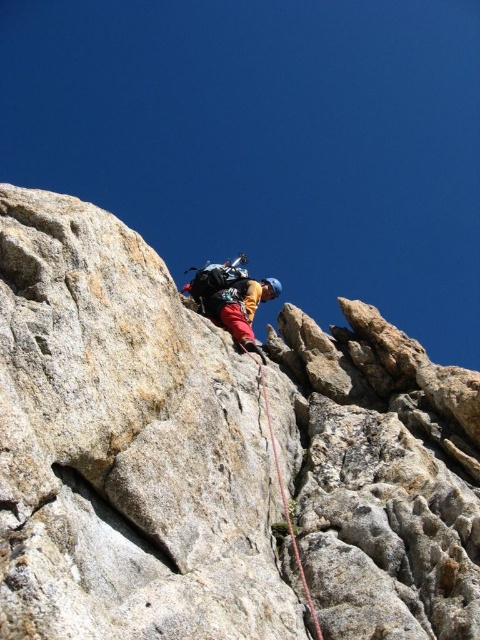
You are a photographer positioned below the climber. You want to take a photo that includes both the gray rock cliff at center and the red nylon rope at center. Based on their positions, which object should you adjust your camera to focus on first to ensure both are in frame?

The gray rock cliff at center is to the right of the red nylon rope at center. To capture both in the frame, focus on the red nylon rope at center first, then adjust to include the gray rock cliff at center to its right.

You are a drone operator trying to capture a photo of the gray rock cliff at center from above. The drone has a camera with a 100mm lens that can focus on objects within a 10cm radius. The drone is currently hovering at point (128, 445). Can you confirm if the gray rock cliff at center is within the camera focus range?

The gray rock cliff at center is located at point (128, 445), so the drone is already hovering directly above it. Therefore, the camera with a 100mm lens can focus on the gray rock cliff at center since it is within the 10cm radius focus range.

You are a safety officer assessing the climbing setup. The gray rock cliff at center and the red nylon rope at center are both critical to the climber. Based on their heights, which one is more likely to provide a secure anchor point for the climber?

The gray rock cliff at center has a greater height compared to the red nylon rope at center, making it more stable and suitable as an anchor point for the climber.